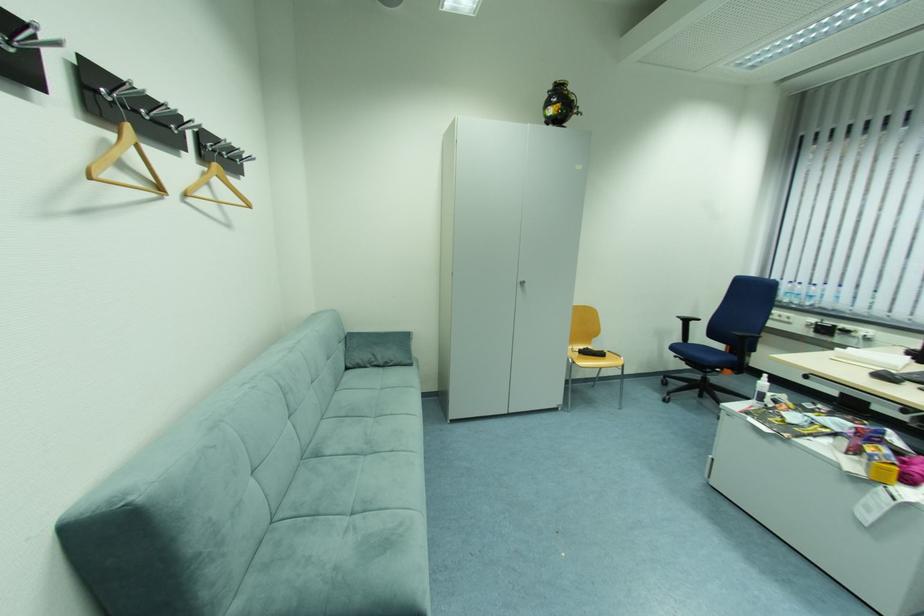
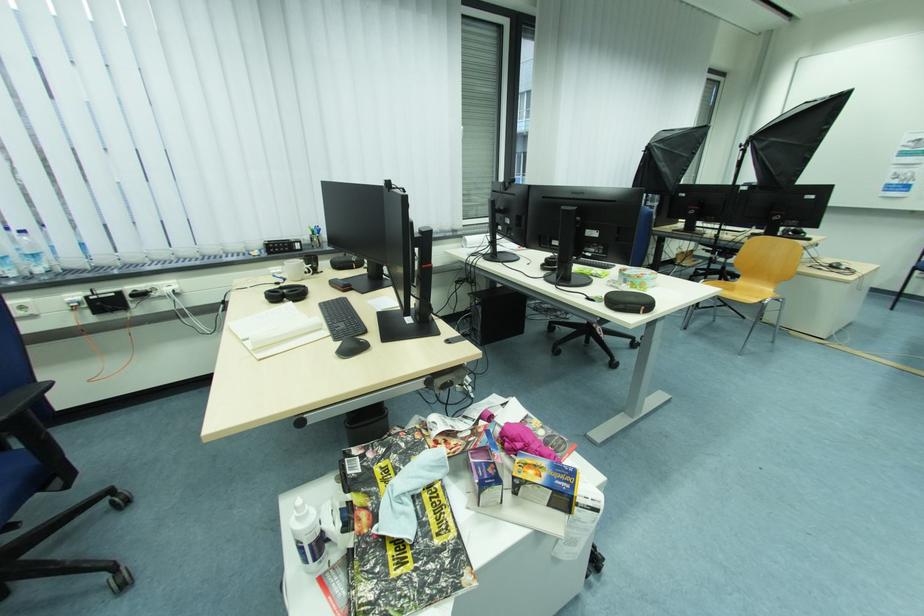
In the second image, find the point that corresponds to point (807, 297) in the first image.

(18, 261)